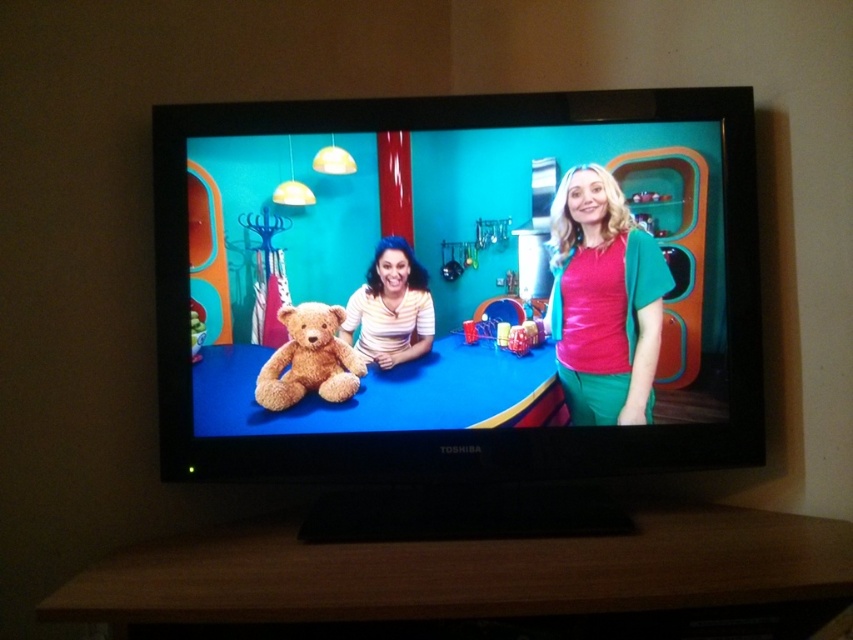
You are an interior designer assessing the placement of items in the image. The scene shows a Toshiba television displaying two people at a blue table. You need to determine which item, the matte green skirt at center or the striped fabric shirt at center, is taller in the displayed scene. Which one is taller?

The matte green skirt at center is taller than the striped fabric shirt at center in the displayed scene.